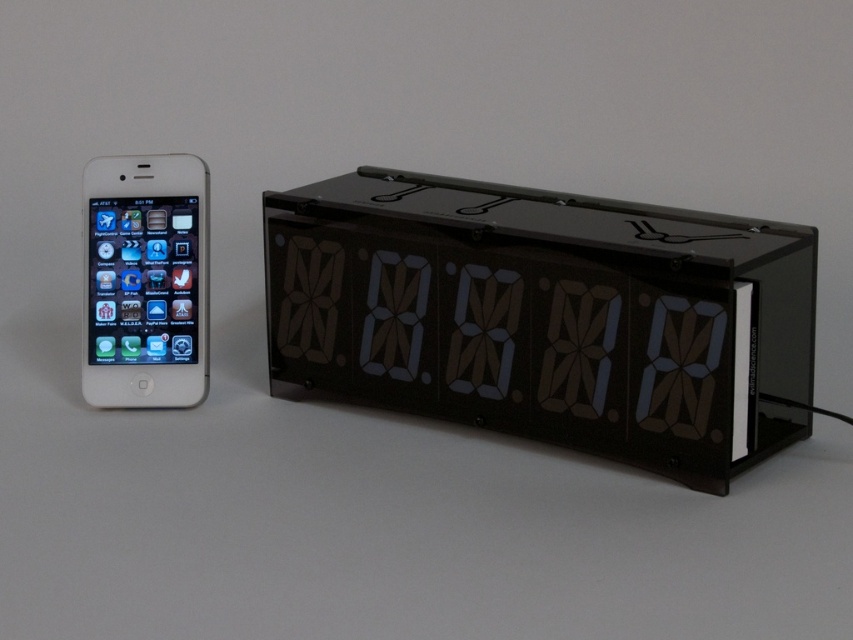
You are standing 4 feet away from the black plastic digital clock at center. Can you reach it without moving your feet?

The black plastic digital clock at center is 3.79 feet away from the viewer. Since you are standing 4 feet away, it is slightly out of reach without moving closer.

You are setting up a desk and want to place both the black plastic digital clock at center and the white glossy ipod at left on the desk. If you want to arrange them so that the clock is above the iPod, is this possible based on their current positions?

The black plastic digital clock at center is currently positioned under the white glossy ipod at left, so to place the clock above the iPod, you would need to rearrange them since they are currently in the opposite position.

You are setting up a nightstand and want to place both the black plastic digital clock at center and the white glossy ipod at left on it. Considering their sizes, which object should you place first to ensure they both fit comfortably?

The black plastic digital clock at center is larger than the white glossy ipod at left, so you should place the black plastic digital clock at center first to ensure both fit comfortably on the nightstand.